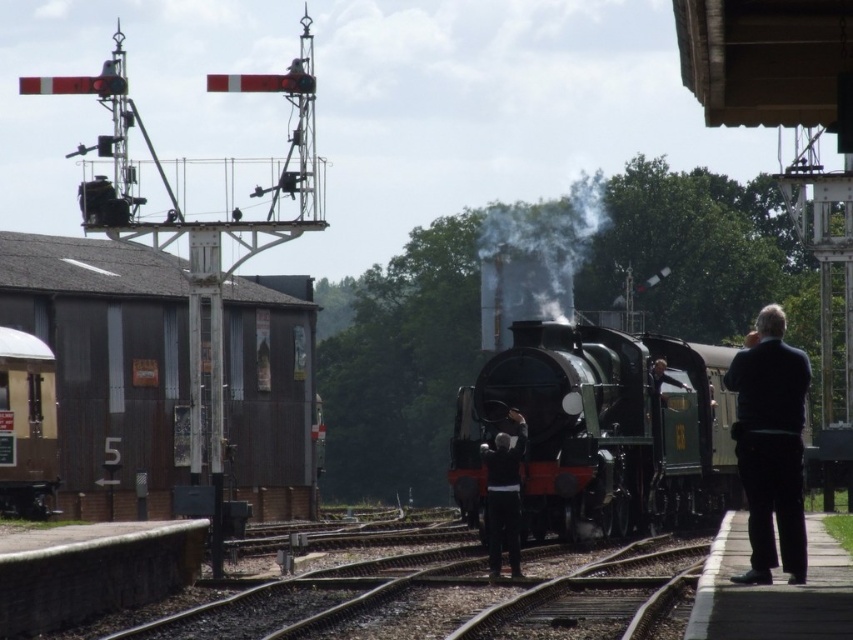
Is smoke/grey at center smaller than dark gray sweater at center?

No, smoke/grey at center is not smaller than dark gray sweater at center.

Does smoke/grey at center appear under dark gray sweater at center?

No.

Is point (526, 236) closer to viewer compared to point (496, 483)?

No, it is not.

Where is `smoke/grey at center`? This screenshot has height=640, width=853. smoke/grey at center is located at coordinates (534, 257).

The height and width of the screenshot is (640, 853). Describe the element at coordinates (601, 429) in the screenshot. I see `shiny black locomotive at center` at that location.

Which is above, shiny black locomotive at center or black woolen jacket at right?

black woolen jacket at right is higher up.

Does point (527, 368) lie in front of point (759, 317)?

No, it is not.

Find the location of a particular element. Image resolution: width=853 pixels, height=640 pixels. shiny black locomotive at center is located at coordinates (601, 429).

Can you confirm if rusty metal building at left is bigger than shiny black locomotive at center?

Yes.

Which is behind, point (265, 348) or point (720, 362)?

Positioned behind is point (265, 348).

What do you see at coordinates (106, 364) in the screenshot? I see `rusty metal building at left` at bounding box center [106, 364].

You are a GUI agent. You are given a task and a screenshot of the screen. Output one action in this format:
    pyautogui.click(x=<x>, y=<y>)
    Task: Click on the rusty metal building at left
    The height and width of the screenshot is (640, 853).
    Given the screenshot: What is the action you would take?
    pyautogui.click(x=106, y=364)